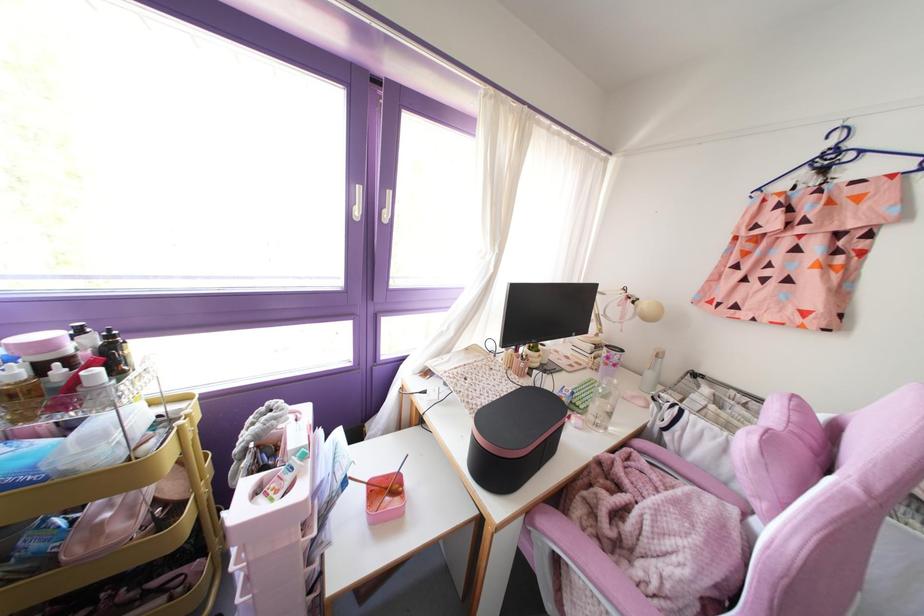
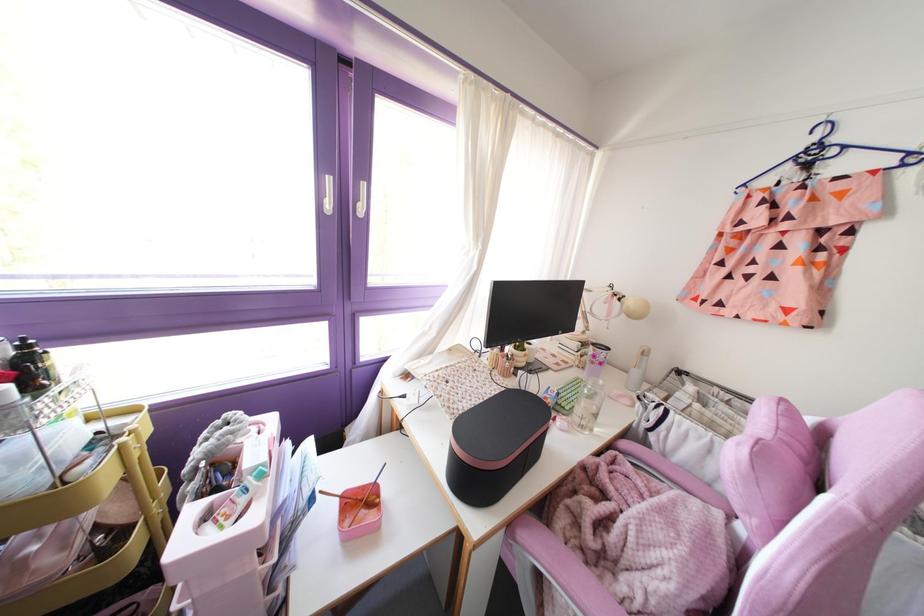
Where in the second image is the point corresponding to [481,418] from the first image?

(459, 426)